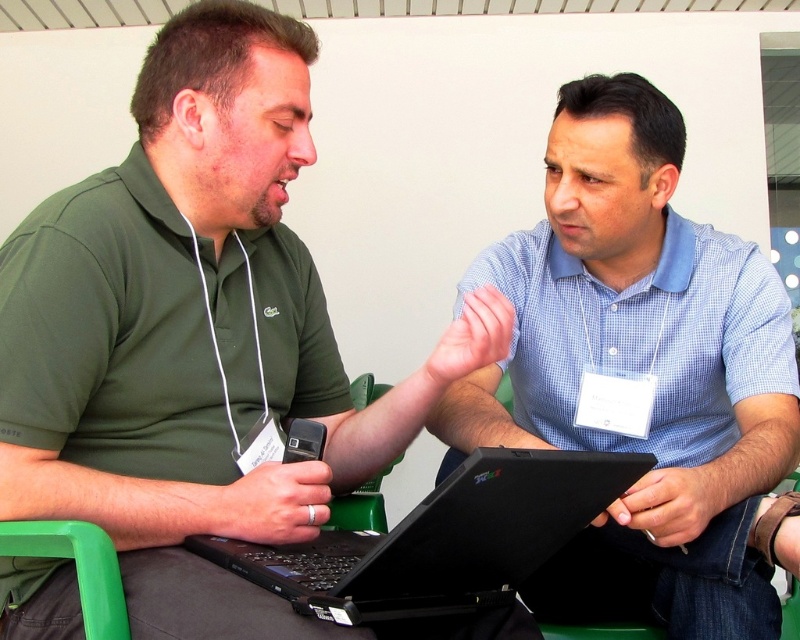
Question: Which object appears farthest from the camera in this image?

Choices:
 (A) green matte shirt at center
 (B) black matte laptop at center

Answer: (B)

Question: Does green matte shirt at center appear over blue checkered shirt at center?

Choices:
 (A) yes
 (B) no

Answer: (A)

Question: Is green matte shirt at center further to camera compared to blue checkered shirt at center?

Choices:
 (A) yes
 (B) no

Answer: (B)

Question: Which point is closer to the camera taking this photo?

Choices:
 (A) (249, 589)
 (B) (550, 524)

Answer: (A)

Question: Where is green matte shirt at center located in relation to blue checkered shirt at center in the image?

Choices:
 (A) above
 (B) below

Answer: (A)

Question: Which point is farther from the camera taking this photo?

Choices:
 (A) (670, 314)
 (B) (584, 508)
 (C) (284, 332)

Answer: (A)